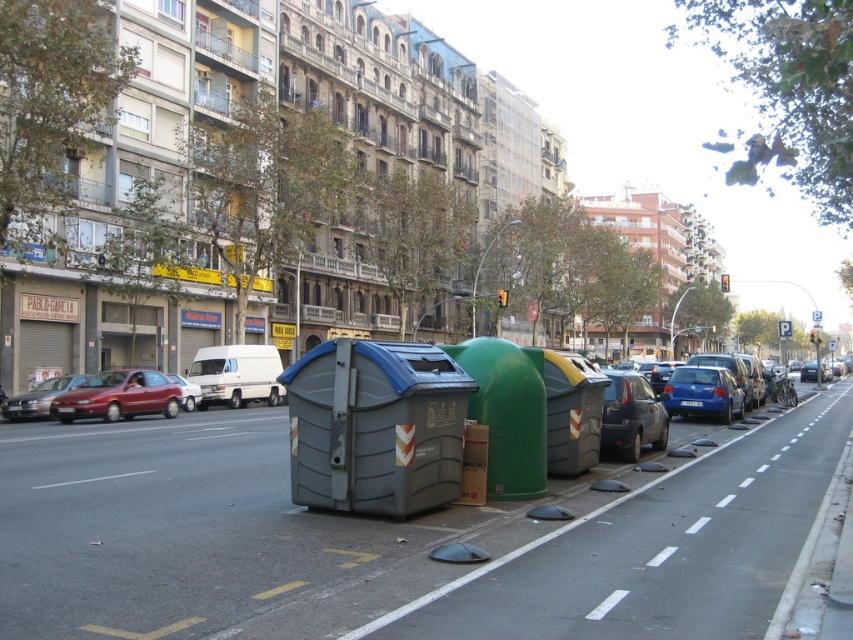
Is point (71, 374) positioned behind point (175, 380)?

That is True.

Is the position of shiny silver sedan at left more distant than that of matte silver car at center-left?

No, shiny silver sedan at left is closer to the viewer.

Who is more distant from viewer, (64, 385) or (184, 406)?

Positioned behind is point (184, 406).

The image size is (853, 640). Identify the location of shiny silver sedan at left. (38, 397).

Measure the distance between white dashed lines at lower right and camera.

The distance of white dashed lines at lower right from camera is 5.33 meters.

Can you confirm if white dashed lines at lower right is taller than matte black car at center?

No, white dashed lines at lower right is not taller than matte black car at center.

Is point (801, 420) less distant than point (631, 387)?

No.

At what (x,y) coordinates should I click in order to perform the action: click on white dashed lines at lower right. Please return your answer as a coordinate pair (x, y). Looking at the image, I should click on (712, 532).

Between gray concrete curb at lower right and metallic red car at left, which one appears on the left side from the viewer's perspective?

Positioned to the left is metallic red car at left.

Where is `gray concrete curb at lower right`? The height and width of the screenshot is (640, 853). gray concrete curb at lower right is located at coordinates (822, 568).